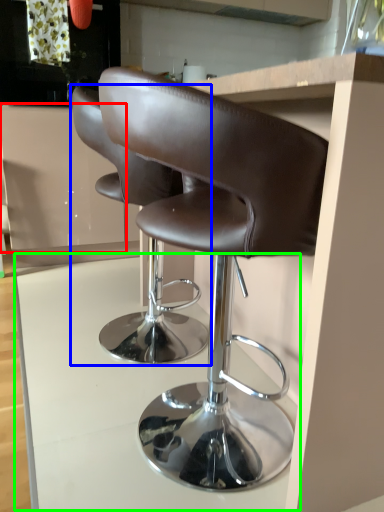
Question: Which object is positioned farthest from cabinetry (highlighted by a red box)? Select from chair (highlighted by a blue box) and table (highlighted by a green box).

Choices:
 (A) chair
 (B) table

Answer: (A)